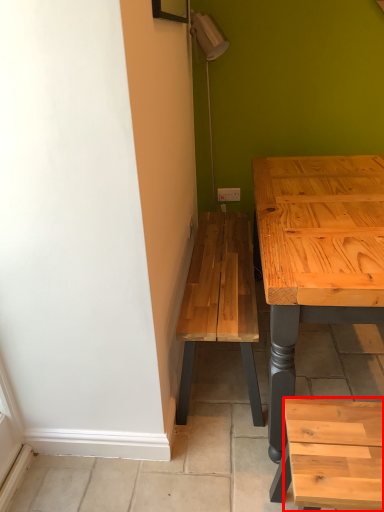
Question: Observing the image, what is the correct spatial positioning of stool (annotated by the red box) in reference to electric outlet?

Choices:
 (A) right
 (B) left

Answer: (A)